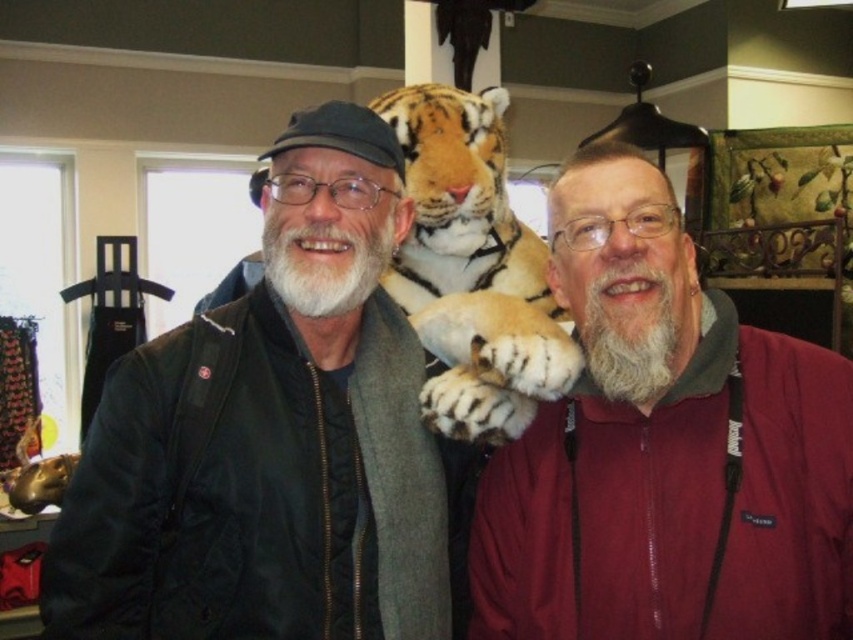
You are a photographer trying to capture a photo of the black matte jacket at left and the maroon fleece jacket at center. Since you want to focus on the jackets, you need to adjust your camera to ensure both are in the frame. Based on their positions, which jacket is higher up in the image?

The black matte jacket at left is located above the maroon fleece jacket at center, so it is higher up in the image.

You are trying to decide which jacket to try on based on size. The black matte jacket at left and the maroon fleece jacket at center are both in your size. However, you prefer a wider jacket for comfort. Which jacket should you choose?

The black matte jacket at left is wider than the maroon fleece jacket at center, so you should choose the black matte jacket at left for more comfort.

You are a photographer trying to capture a clear shot of both the maroon fleece jacket at center and the orange fur tiger at center. Since you want to focus on the larger object, which one should you prioritize in your composition?

The orange fur tiger at center should be prioritized as it occupies more space than the maroon fleece jacket at center, making it the larger object in the scene.